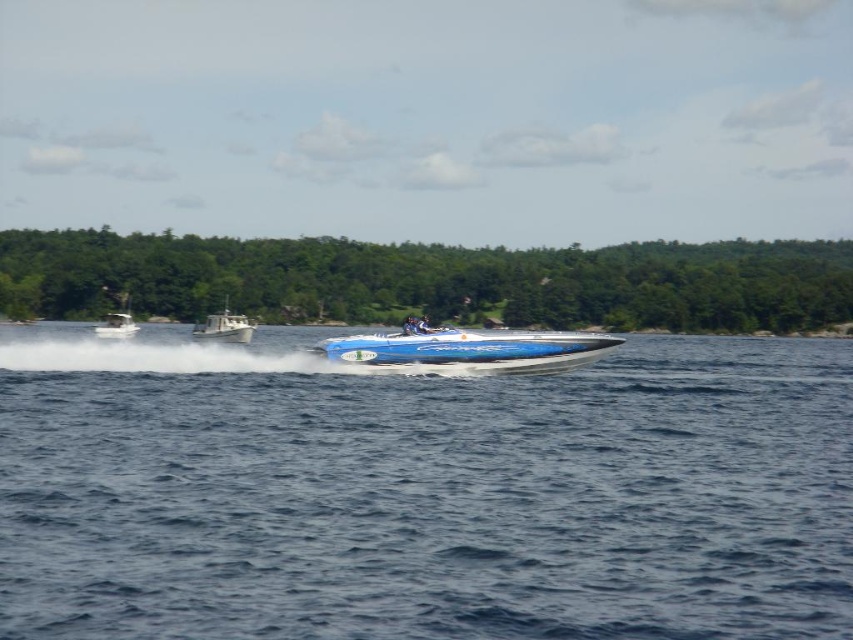
You are a photographer trying to capture the blue metallic speedboat at center and the blue glossy speedboat at center in a single shot. Which boat appears smaller in the photo?

The blue metallic speedboat at center appears smaller in the photo because it occupies less space than the blue glossy speedboat at center.

You are a photographer trying to capture the blue metallic speedboat at center and the blue glossy speedboat at center in the same frame. Which boat should you position closer to the left side of your camera frame to ensure both are visible?

You should position the blue glossy speedboat at center closer to the left side of your camera frame because the blue metallic speedboat at center is already to the right of it.

You are a photographer trying to capture the reflection of the blue glossy speedboat at center in the blue glossy water at center. Based on the scene, can you confirm if the reflection will be visible?

The blue glossy water at center is positioned under the blue glossy speedboat at center, so the reflection of the blue glossy speedboat at center should be clearly visible in the blue glossy water at center.